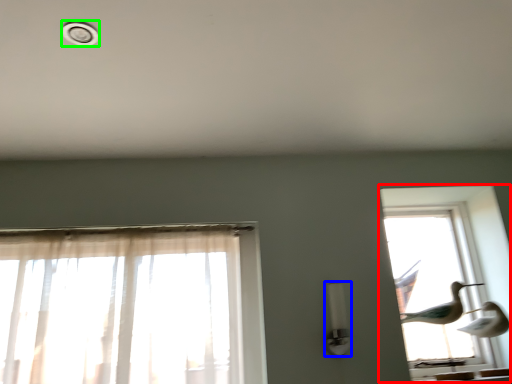
Question: Which is farther away from window (highlighted by a red box)? light fixture (highlighted by a blue box) or dot (highlighted by a green box)?

Choices:
 (A) light fixture
 (B) dot

Answer: (B)